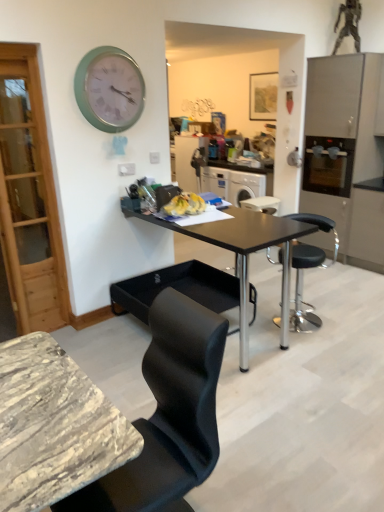
Question: From a real-world perspective, is satin silver oven at right over wooden picture frame at upper center?

Choices:
 (A) no
 (B) yes

Answer: (A)

Question: Is satin silver oven at right completely or partially outside of wooden picture frame at upper center?

Choices:
 (A) no
 (B) yes

Answer: (B)

Question: Is satin silver oven at right bigger than wooden picture frame at upper center?

Choices:
 (A) no
 (B) yes

Answer: (B)

Question: Can you confirm if satin silver oven at right is thinner than wooden picture frame at upper center?

Choices:
 (A) yes
 (B) no

Answer: (B)

Question: Considering the relative sizes of satin silver oven at right and wooden picture frame at upper center in the image provided, is satin silver oven at right shorter than wooden picture frame at upper center?

Choices:
 (A) yes
 (B) no

Answer: (A)

Question: From a real-world perspective, is black leather bar stool at center physically located above or below teal metallic clock at upper left?

Choices:
 (A) below
 (B) above

Answer: (A)

Question: From the image's perspective, is black leather bar stool at center located above or below teal metallic clock at upper left?

Choices:
 (A) below
 (B) above

Answer: (A)

Question: Considering their positions, is black leather bar stool at center located in front of or behind teal metallic clock at upper left?

Choices:
 (A) front
 (B) behind

Answer: (B)

Question: Does point (299, 322) appear closer or farther from the camera than point (112, 129)?

Choices:
 (A) closer
 (B) farther

Answer: (B)

Question: Is black leather bar stool at center taller or shorter than wooden picture frame at upper center?

Choices:
 (A) short
 (B) tall

Answer: (B)

Question: In the image, is black leather bar stool at center positioned in front of or behind wooden picture frame at upper center?

Choices:
 (A) behind
 (B) front

Answer: (B)

Question: From the image's perspective, is black leather bar stool at center positioned above or below wooden picture frame at upper center?

Choices:
 (A) above
 (B) below

Answer: (B)

Question: Does point (302, 329) appear closer or farther from the camera than point (256, 96)?

Choices:
 (A) closer
 (B) farther

Answer: (A)

Question: In the image, is satin silver cabinet at right positioned in front of or behind black matte table at center?

Choices:
 (A) behind
 (B) front

Answer: (A)

Question: From the image's perspective, relative to black matte table at center, is satin silver cabinet at right above or below?

Choices:
 (A) above
 (B) below

Answer: (A)